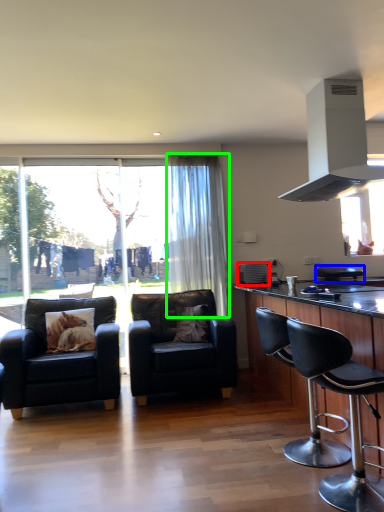
Question: Considering the real-world distances, which object is farthest from appliance (highlighted by a red box)? chair (highlighted by a blue box) or curtain (highlighted by a green box)?

Choices:
 (A) chair
 (B) curtain

Answer: (A)